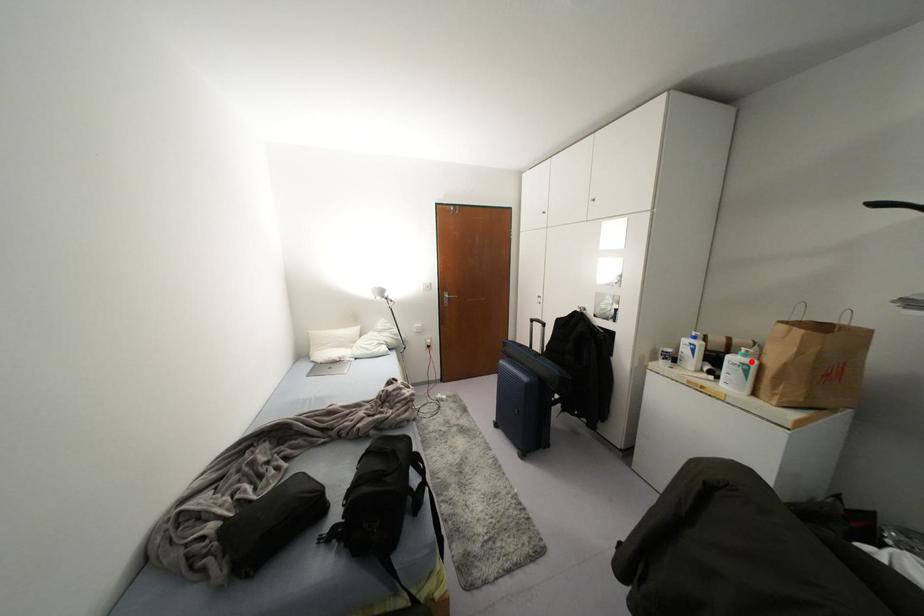
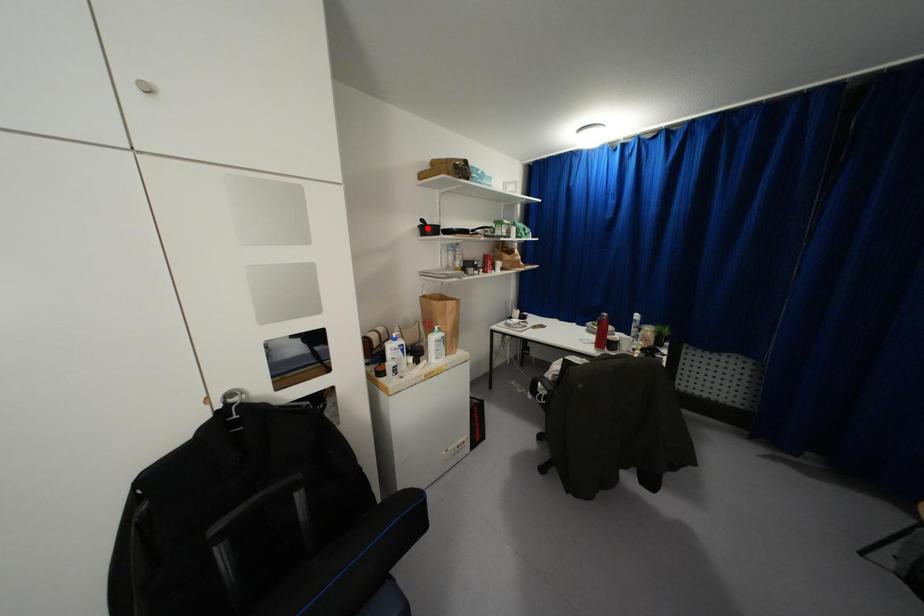
I am providing you with two images of the same scene from different viewpoints. A red point is marked on the first image and another point is marked on the second image. Do the highlighted points in image1 and image2 indicate the same real-world spot?

No